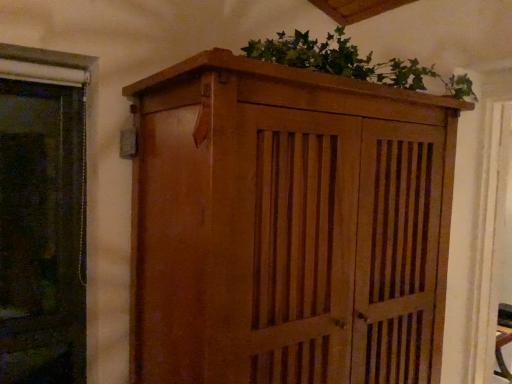
This screenshot has width=512, height=384. Describe the element at coordinates (287, 226) in the screenshot. I see `wooden cabinet at center` at that location.

Find the location of a particular element. This screenshot has height=384, width=512. wooden cabinet at center is located at coordinates (287, 226).

Locate an element on the screen. The height and width of the screenshot is (384, 512). green leafy plant at upper center is located at coordinates (352, 62).

The width and height of the screenshot is (512, 384). What do you see at coordinates (352, 62) in the screenshot?
I see `green leafy plant at upper center` at bounding box center [352, 62].

Where is `wooden cabinet at center`? The height and width of the screenshot is (384, 512). wooden cabinet at center is located at coordinates (287, 226).

Is wooden cabinet at center to the left or to the right of green leafy plant at upper center in the image?

Based on their positions, wooden cabinet at center is located to the left of green leafy plant at upper center.

Based on the photo, is wooden cabinet at center behind green leafy plant at upper center?

No, wooden cabinet at center is in front of green leafy plant at upper center.

Between point (161, 155) and point (321, 70), which one is positioned behind?

The point (161, 155) is more distant.

From the image's perspective, relative to green leafy plant at upper center, is wooden cabinet at center above or below?

Clearly, from the image's perspective, wooden cabinet at center is below green leafy plant at upper center.

From a real-world perspective, is wooden cabinet at center positioned under green leafy plant at upper center based on gravity?

Indeed, from a real-world perspective, wooden cabinet at center is positioned beneath green leafy plant at upper center.

In terms of width, does wooden cabinet at center look wider or thinner when compared to green leafy plant at upper center?

Considering their sizes, wooden cabinet at center looks broader than green leafy plant at upper center.

Between wooden cabinet at center and green leafy plant at upper center, which one has less height?

green leafy plant at upper center is shorter.

Based on their sizes in the image, would you say wooden cabinet at center is bigger or smaller than green leafy plant at upper center?

Clearly, wooden cabinet at center is larger in size than green leafy plant at upper center.

Is wooden cabinet at center not within green leafy plant at upper center?

wooden cabinet at center lies outside green leafy plant at upper center's area.

Is wooden cabinet at center placed right next to green leafy plant at upper center?

They are not placed beside each other.

Is green leafy plant at upper center at the back of wooden cabinet at center?

wooden cabinet at center does not have its back to green leafy plant at upper center.

The image size is (512, 384). I want to click on houseplant positioned vertically above the wooden cabinet at center (from a real-world perspective), so click(352, 62).

Visually, is green leafy plant at upper center positioned to the left or to the right of wooden cabinet at center?

green leafy plant at upper center is positioned on wooden cabinet at center's right side.

Which object is more forward, green leafy plant at upper center or wooden cabinet at center?

wooden cabinet at center is in front.

Is point (467, 94) farther from camera compared to point (165, 207)?

Yes.

From the image's perspective, is green leafy plant at upper center located beneath wooden cabinet at center?

No.

Looking at this image, from a real-world perspective, is green leafy plant at upper center physically below wooden cabinet at center?

Incorrect, from a real-world perspective, green leafy plant at upper center is higher than wooden cabinet at center.

Is green leafy plant at upper center wider or thinner than wooden cabinet at center?

green leafy plant at upper center is thinner than wooden cabinet at center.

In terms of height, does green leafy plant at upper center look taller or shorter compared to wooden cabinet at center?

Clearly, green leafy plant at upper center is shorter compared to wooden cabinet at center.

Between green leafy plant at upper center and wooden cabinet at center, which one has larger size?

wooden cabinet at center is bigger.

Is wooden cabinet at center located within green leafy plant at upper center?

Definitely not — wooden cabinet at center is not inside green leafy plant at upper center.

Is green leafy plant at upper center far from wooden cabinet at center?

Actually, green leafy plant at upper center and wooden cabinet at center are a little close together.

Could you tell me if green leafy plant at upper center is facing wooden cabinet at center?

No, green leafy plant at upper center is not aimed at wooden cabinet at center.

How many degrees apart are the facing directions of green leafy plant at upper center and wooden cabinet at center?

The angle between the facing direction of green leafy plant at upper center and the facing direction of wooden cabinet at center is 1.53 degrees.

Find the location of `cupboard below the green leafy plant at upper center (from a real-world perspective)`. cupboard below the green leafy plant at upper center (from a real-world perspective) is located at coordinates (287, 226).

In order to click on houseplant above the wooden cabinet at center (from the image's perspective) in this screenshot , I will do tap(352, 62).

Locate an element on the screen. This screenshot has width=512, height=384. houseplant above the wooden cabinet at center (from a real-world perspective) is located at coordinates (352, 62).